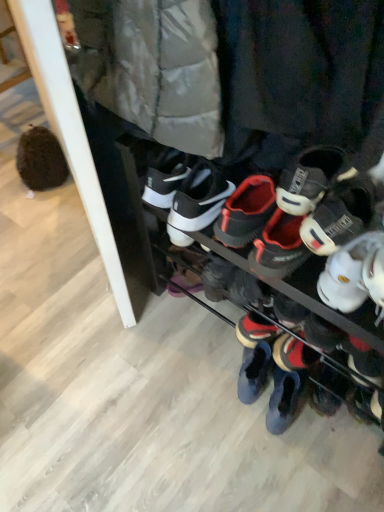
Where is `free location to the left of black matte sneakers at center, the first footwear in the front-to-back sequence`? The image size is (384, 512). free location to the left of black matte sneakers at center, the first footwear in the front-to-back sequence is located at coordinates (119, 380).